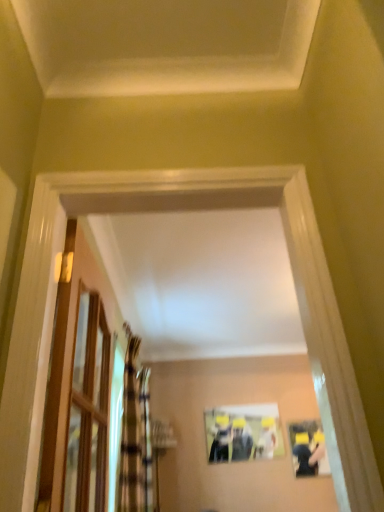
Question: From the image's perspective, relative to clear glass door at left, is gold textured curtain at left, which is the 1th curtain from front to back, above or below?

Choices:
 (A) below
 (B) above

Answer: (A)

Question: In the image, is gold textured curtain at left, which is the 1th curtain from front to back, on the left side or the right side of clear glass door at left?

Choices:
 (A) left
 (B) right

Answer: (A)

Question: Considering the real-world distances, which object is closest to the matte plastic picture frame at center?

Choices:
 (A) clear glass door at left
 (B) gold textured curtain at left, arranged as the second curtain when viewed from the back
 (C) plaid fabric curtain at left, which is the 2th curtain from front to back
 (D) matte black couple at center

Answer: (D)

Question: Which object is positioned farthest from the clear glass door at left?

Choices:
 (A) gold textured curtain at left, arranged as the second curtain when viewed from the back
 (B) plaid fabric curtain at left, the 1th curtain from the back
 (C) matte plastic picture frame at center
 (D) matte black couple at center

Answer: (D)